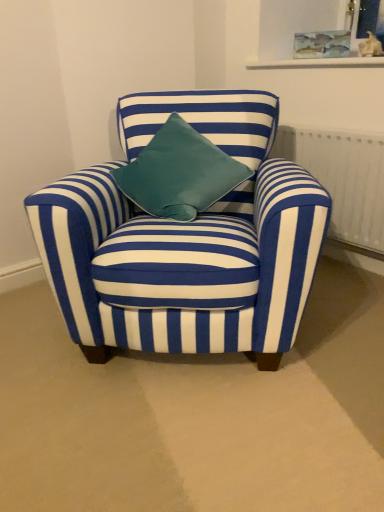
Question: In which direction should I rotate to look at watercolor paper picture frame at upper center?

Choices:
 (A) right
 (B) left

Answer: (A)

Question: From a real-world perspective, is watercolor paper picture frame at upper center under blue striped fabric chair at center?

Choices:
 (A) yes
 (B) no

Answer: (B)

Question: Is the position of watercolor paper picture frame at upper center less distant than that of blue striped fabric chair at center?

Choices:
 (A) yes
 (B) no

Answer: (B)

Question: Is watercolor paper picture frame at upper center directly adjacent to blue striped fabric chair at center?

Choices:
 (A) yes
 (B) no

Answer: (B)

Question: Can you confirm if watercolor paper picture frame at upper center is shorter than blue striped fabric chair at center?

Choices:
 (A) no
 (B) yes

Answer: (B)

Question: From the image's perspective, is watercolor paper picture frame at upper center located above blue striped fabric chair at center?

Choices:
 (A) yes
 (B) no

Answer: (A)

Question: Is watercolor paper picture frame at upper center at the right side of blue striped fabric chair at center?

Choices:
 (A) no
 (B) yes

Answer: (B)

Question: From the image's perspective, is blue striped fabric chair at center over watercolor paper picture frame at upper center?

Choices:
 (A) no
 (B) yes

Answer: (A)

Question: Can you confirm if blue striped fabric chair at center is smaller than watercolor paper picture frame at upper center?

Choices:
 (A) no
 (B) yes

Answer: (A)

Question: Is blue striped fabric chair at center directly adjacent to watercolor paper picture frame at upper center?

Choices:
 (A) yes
 (B) no

Answer: (B)

Question: From a real-world perspective, is blue striped fabric chair at center over watercolor paper picture frame at upper center?

Choices:
 (A) yes
 (B) no

Answer: (B)

Question: From the image's perspective, is blue striped fabric chair at center below watercolor paper picture frame at upper center?

Choices:
 (A) yes
 (B) no

Answer: (A)

Question: Is blue striped fabric chair at center to the right of watercolor paper picture frame at upper center from the viewer's perspective?

Choices:
 (A) yes
 (B) no

Answer: (B)

Question: Does white textured radiator at right lie behind blue striped fabric chair at center?

Choices:
 (A) yes
 (B) no

Answer: (A)